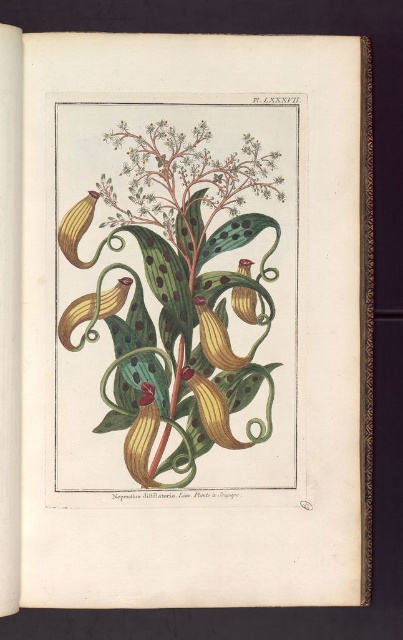
Question: Is yellow-green textured pod at center smaller than green matte leaf at center?

Choices:
 (A) no
 (B) yes

Answer: (A)

Question: Which point is closer to the camera?

Choices:
 (A) (141, 404)
 (B) (176, 221)

Answer: (A)

Question: Is yellow-green textured pod at center to the left of green matte leaf at center from the viewer's perspective?

Choices:
 (A) no
 (B) yes

Answer: (A)

Question: Can you confirm if yellow-green textured pod at center is smaller than green matte leaf at center?

Choices:
 (A) no
 (B) yes

Answer: (A)